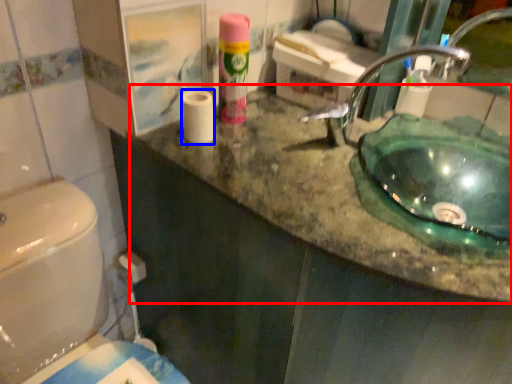
Question: Which point is closer to the camera, counter top (highlighted by a red box) or toilet paper (highlighted by a blue box)?

Choices:
 (A) counter top
 (B) toilet paper

Answer: (A)